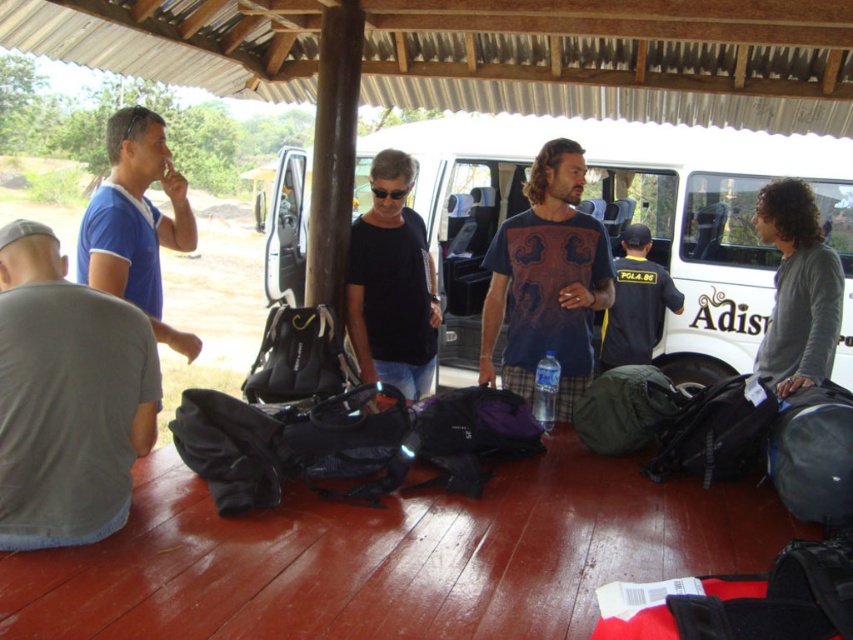
You are a photographer trying to capture a clear shot of the gray cotton shirt at lower left and the white matte van at center. However, the van is blocking your view. Can you move around to the left side of the van to get a better angle for both subjects?

The gray cotton shirt at lower left is behind the white matte van at center, so moving to the left side of the van may allow you to see both subjects if there is an unobstructed path. However, since the shirt is behind the van, you might need to position yourself where the van no longer blocks the view of the shirt.

You are a photographer standing at the edge of the shelter. You want to take a photo that includes both the gray cotton shirt at lower left and the dark blue uniform at center. Given that your camera can focus on objects within a 5 meter range, will both subjects be in focus?

The gray cotton shirt at lower left is 4.62 meters from the dark blue uniform at center. Since the camera can focus within 5 meters, both subjects will be within the focus range and thus in focus.